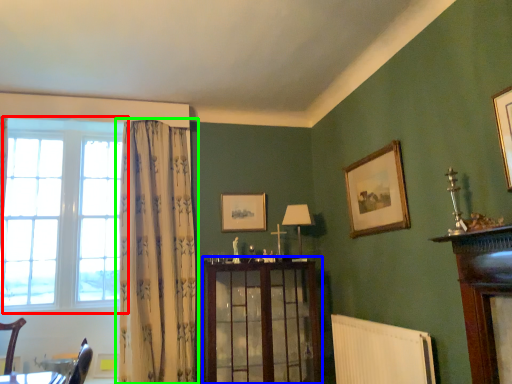
Question: Estimate the real-world distances between objects in this image. Which object is closer to window (highlighted by a red box), dresser (highlighted by a blue box) or curtain (highlighted by a green box)?

Choices:
 (A) dresser
 (B) curtain

Answer: (B)